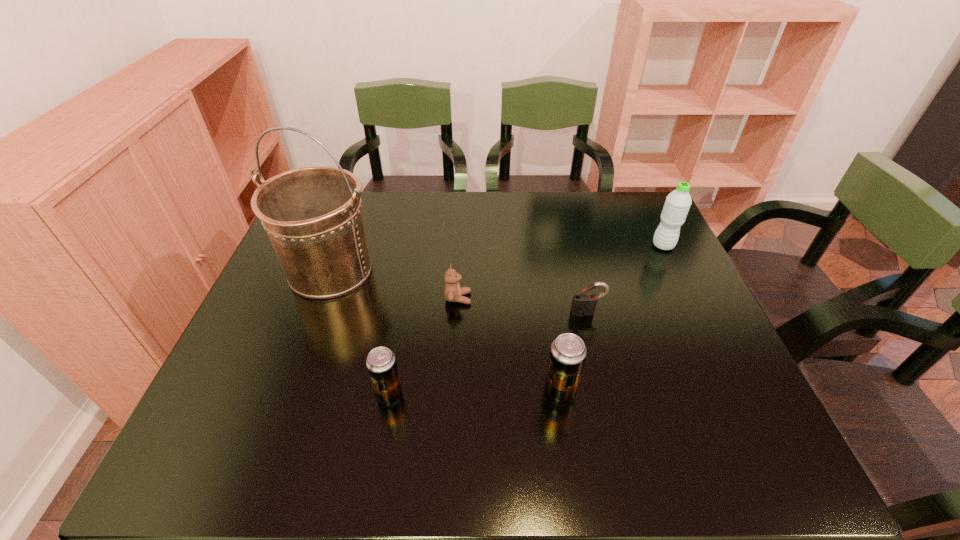
Please show where to add a beer can on the right while keeping spacing even. Please provide its 2D coordinates. Your answer should be formatted as a tuple, i.e. [(x, y)], where the tuple contains the x and y coordinates of a point satisfying the conditions above.

[(728, 391)]